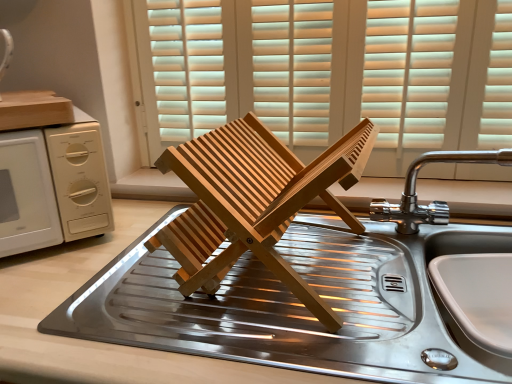
Question: Can you confirm if wooden blinds at center is taller than stainless steel sink at center?

Choices:
 (A) yes
 (B) no

Answer: (A)

Question: From a real-world perspective, does wooden blinds at center sit lower than stainless steel sink at center?

Choices:
 (A) yes
 (B) no

Answer: (B)

Question: Considering the relative sizes of wooden blinds at center and stainless steel sink at center in the image provided, is wooden blinds at center bigger than stainless steel sink at center?

Choices:
 (A) no
 (B) yes

Answer: (A)

Question: Is wooden blinds at center looking in the opposite direction of stainless steel sink at center?

Choices:
 (A) no
 (B) yes

Answer: (A)

Question: Does wooden blinds at center touch stainless steel sink at center?

Choices:
 (A) yes
 (B) no

Answer: (B)

Question: Is wooden blinds at center completely or partially outside of stainless steel sink at center?

Choices:
 (A) yes
 (B) no

Answer: (A)

Question: Is chrome metallic faucet at upper right not inside stainless steel sink at center?

Choices:
 (A) yes
 (B) no

Answer: (A)

Question: From the image's perspective, is chrome metallic faucet at upper right below stainless steel sink at center?

Choices:
 (A) no
 (B) yes

Answer: (A)

Question: Is chrome metallic faucet at upper right positioned before stainless steel sink at center?

Choices:
 (A) yes
 (B) no

Answer: (B)

Question: From a real-world perspective, is chrome metallic faucet at upper right located higher than stainless steel sink at center?

Choices:
 (A) no
 (B) yes

Answer: (B)

Question: From the image's perspective, is chrome metallic faucet at upper right on top of stainless steel sink at center?

Choices:
 (A) no
 (B) yes

Answer: (B)

Question: Does chrome metallic faucet at upper right appear on the left side of stainless steel sink at center?

Choices:
 (A) yes
 (B) no

Answer: (B)

Question: From a real-world perspective, is chrome metallic faucet at upper right physically below white matte microwave at left?

Choices:
 (A) no
 (B) yes

Answer: (A)